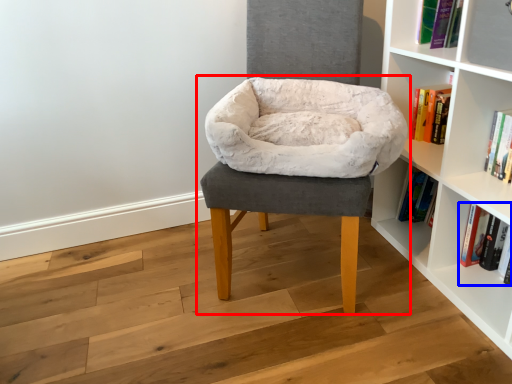
Question: Which object appears farthest to the camera in this image, chair (highlighted by a red box) or book (highlighted by a blue box)?

Choices:
 (A) chair
 (B) book

Answer: (B)